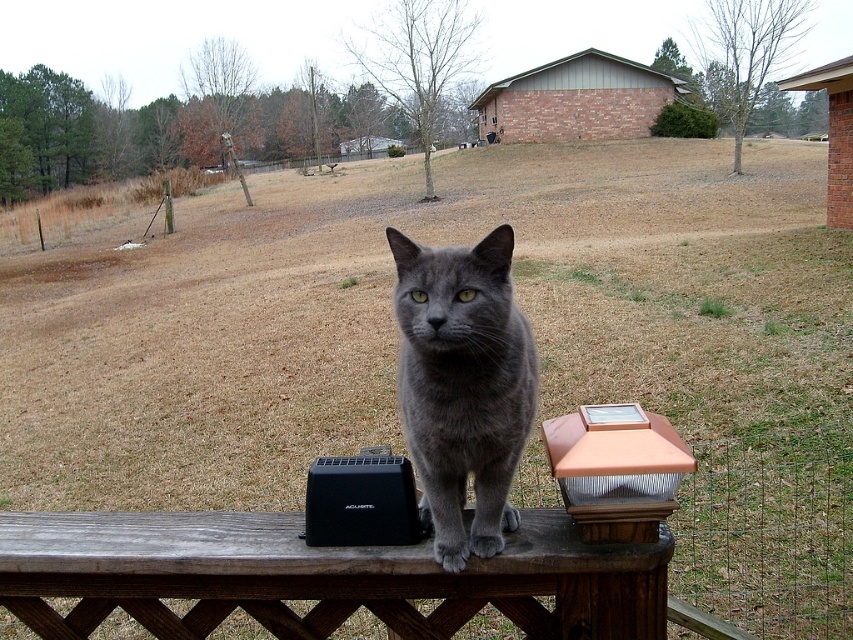
Question: Which point is closer to the camera taking this photo?

Choices:
 (A) (13, 563)
 (B) (590, 452)

Answer: (B)

Question: Can you confirm if gray matte fur cat at center is bigger than copper metallic solar light post at center?

Choices:
 (A) yes
 (B) no

Answer: (A)

Question: Can you confirm if wooden bench at center is positioned to the left of copper metallic solar light post at center?

Choices:
 (A) yes
 (B) no

Answer: (A)

Question: Among these points, which one is nearest to the camera?

Choices:
 (A) (428, 483)
 (B) (540, 570)
 (C) (633, 458)

Answer: (C)

Question: Is gray matte fur cat at center closer to the viewer compared to copper metallic solar light post at center?

Choices:
 (A) no
 (B) yes

Answer: (B)

Question: Which point is closer to the camera?

Choices:
 (A) copper metallic solar light post at center
 (B) wooden bench at center

Answer: (A)